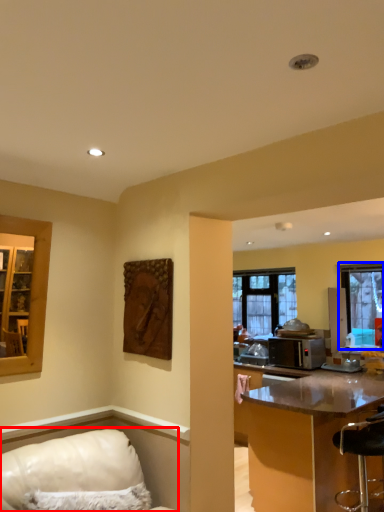
Question: Which object is closer to the camera taking this photo, furniture (highlighted by a red box) or window (highlighted by a blue box)?

Choices:
 (A) furniture
 (B) window

Answer: (A)